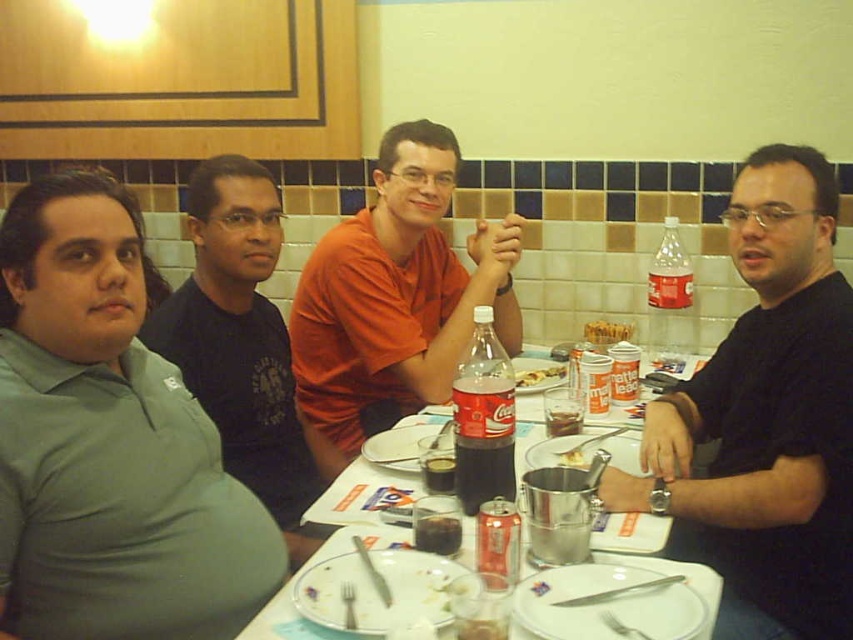
You are sitting at the table in the image and want to reach for an item located at one of the two points mentioned. Which point is closer to you, point (277, 362) or point (581, 422)?

Point (581, 422) is closer to you because point (277, 362) is behind it.

You are a waiter who needs to clear the table. You see the dark brown liquid at table center and the white porcelain bowl at center. Which item is taller?

The dark brown liquid at table center is taller than the white porcelain bowl at center.